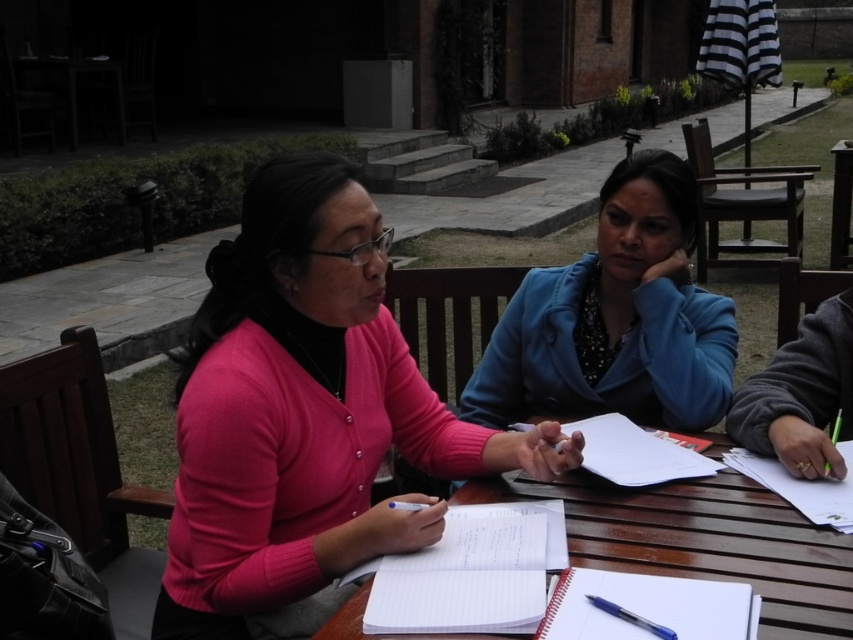
Measure the distance between point (276, 195) and camera.

Point (276, 195) and camera are 1.26 meters apart.

Image resolution: width=853 pixels, height=640 pixels. In order to click on pink sweater at center in this screenshot , I will do `click(305, 417)`.

Between point (215, 408) and point (614, 387), which one is positioned behind?

Point (614, 387)

Image resolution: width=853 pixels, height=640 pixels. In order to click on pink sweater at center in this screenshot , I will do `click(305, 417)`.

Can you confirm if spiral notebook at lower center is positioned to the right of blue plastic pen at lower center?

Yes, spiral notebook at lower center is to the right of blue plastic pen at lower center.

Who is positioned more to the left, spiral notebook at lower center or blue plastic pen at lower center?

blue plastic pen at lower center is more to the left.

This screenshot has height=640, width=853. I want to click on spiral notebook at lower center, so click(648, 605).

Identify the location of spiral notebook at lower center. This screenshot has width=853, height=640. (648, 605).

How much distance is there between white paper at center and blue plastic pen at lower center?

white paper at center and blue plastic pen at lower center are 20.61 inches apart from each other.

Does white paper at center appear over blue plastic pen at lower center?

Indeed, white paper at center is positioned over blue plastic pen at lower center.

I want to click on white paper at center, so click(635, 452).